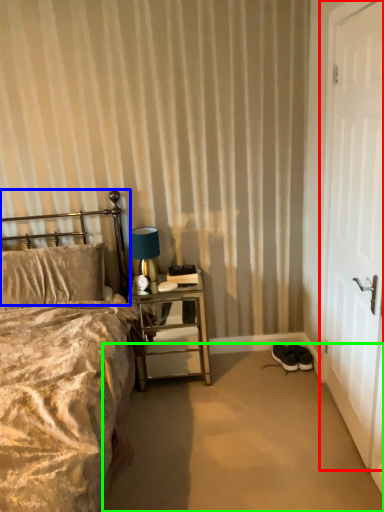
Question: Which is farther away from door (highlighted by a red box)? headboard (highlighted by a blue box) or plain (highlighted by a green box)?

Choices:
 (A) headboard
 (B) plain

Answer: (A)